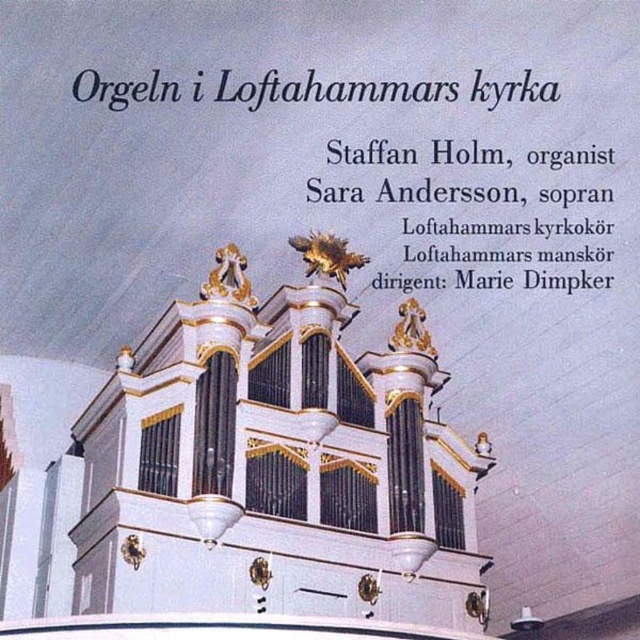
Question: Where is white polished wood organ at center located in relation to white paper at upper center in the image?

Choices:
 (A) right
 (B) left

Answer: (B)

Question: Is white polished wood organ at center positioned at the back of white paper at upper center?

Choices:
 (A) no
 (B) yes

Answer: (A)

Question: Is the position of white polished wood organ at center less distant than that of white paper at upper center?

Choices:
 (A) no
 (B) yes

Answer: (B)